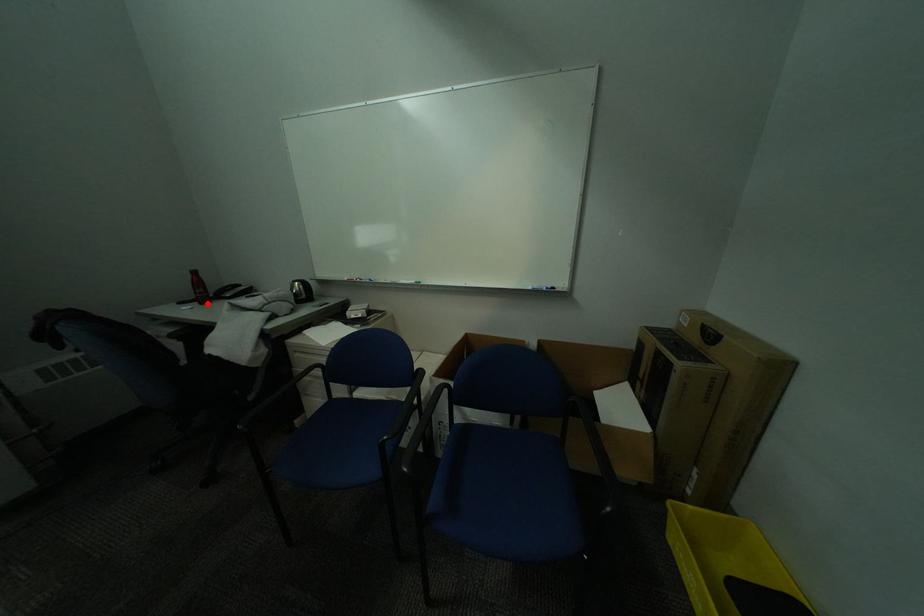
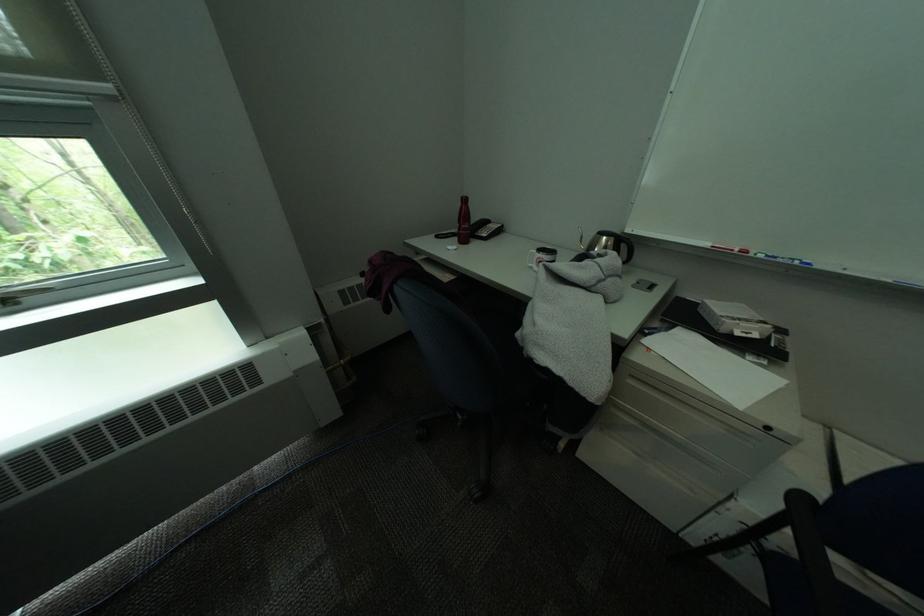
The point at the highlighted location is marked in the first image. Where is the corresponding point in the second image?

(466, 241)